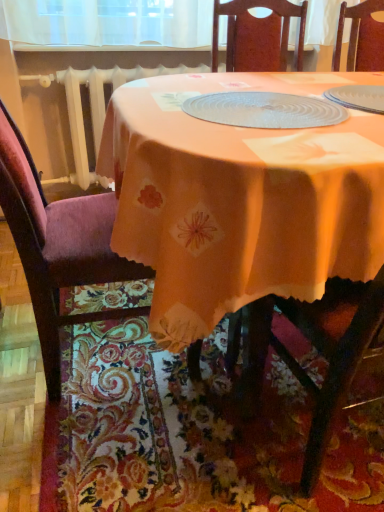
Question: Is velvet purple chair at left bigger than orange fabric table at center?

Choices:
 (A) yes
 (B) no

Answer: (B)

Question: Is velvet purple chair at left at the right side of orange fabric table at center?

Choices:
 (A) yes
 (B) no

Answer: (B)

Question: Is velvet purple chair at left positioned in front of orange fabric table at center?

Choices:
 (A) no
 (B) yes

Answer: (A)

Question: From a real-world perspective, is velvet purple chair at left located higher than orange fabric table at center?

Choices:
 (A) no
 (B) yes

Answer: (B)

Question: From the image's perspective, is velvet purple chair at left on orange fabric table at center?

Choices:
 (A) no
 (B) yes

Answer: (B)

Question: Is orange fabric placemat at lower center situated inside velvet purple chair at left or outside?

Choices:
 (A) outside
 (B) inside

Answer: (A)

Question: From the image's perspective, is orange fabric placemat at lower center located above or below velvet purple chair at left?

Choices:
 (A) above
 (B) below

Answer: (B)

Question: Looking at the image, does orange fabric placemat at lower center seem bigger or smaller compared to velvet purple chair at left?

Choices:
 (A) small
 (B) big

Answer: (A)

Question: Based on their positions, is orange fabric placemat at lower center located to the left or right of velvet purple chair at left?

Choices:
 (A) left
 (B) right

Answer: (B)

Question: From a real-world perspective, is orange fabric placemat at lower center physically located above or below clear plastic placemat at center?

Choices:
 (A) above
 (B) below

Answer: (B)

Question: From the image's perspective, is orange fabric placemat at lower center located above or below clear plastic placemat at center?

Choices:
 (A) above
 (B) below

Answer: (B)

Question: Considering their positions, is orange fabric placemat at lower center located in front of or behind clear plastic placemat at center?

Choices:
 (A) front
 (B) behind

Answer: (A)

Question: Considering the positions of orange fabric placemat at lower center and clear plastic placemat at center in the image, is orange fabric placemat at lower center taller or shorter than clear plastic placemat at center?

Choices:
 (A) short
 (B) tall

Answer: (B)

Question: From a real-world perspective, is orange fabric table at center physically located above or below velvet purple chair at left?

Choices:
 (A) below
 (B) above

Answer: (A)

Question: Considering the positions of point (357, 120) and point (79, 229), is point (357, 120) closer or farther from the camera than point (79, 229)?

Choices:
 (A) closer
 (B) farther

Answer: (A)